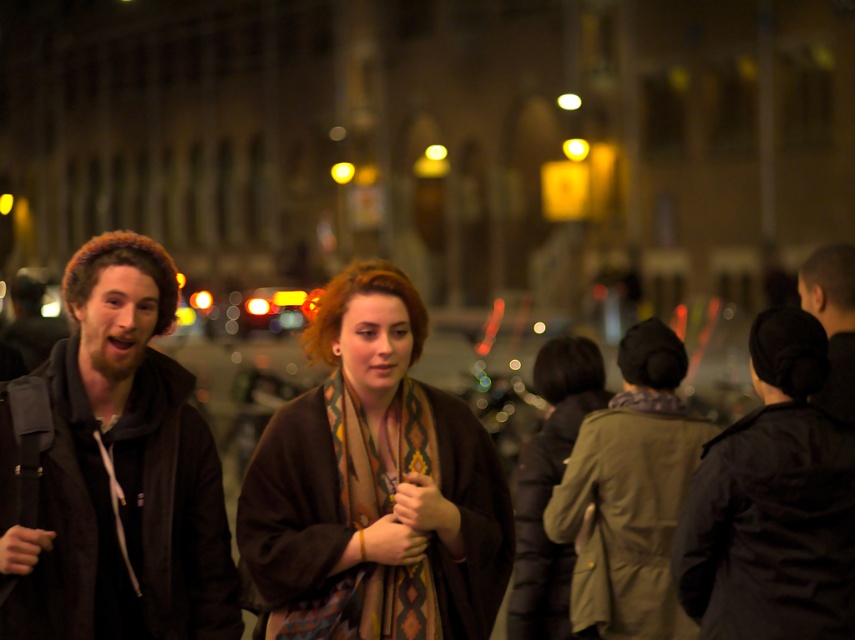
You are a photographer trying to capture a group photo of the two people in the center of the image. The camera you have can only focus on objects within a 1.5 meter width. Given that the brown woolen coat at center is wider than the black matte jacket at center, will the camera be able to capture both individuals within the frame without cropping either of them?

The brown woolen coat at center is wider than the black matte jacket at center. Since the camera can only focus on objects within a 1.5 meter width, and the total width of both individuals combined exceeds this limit, the camera will not be able to capture both within the frame without cropping.